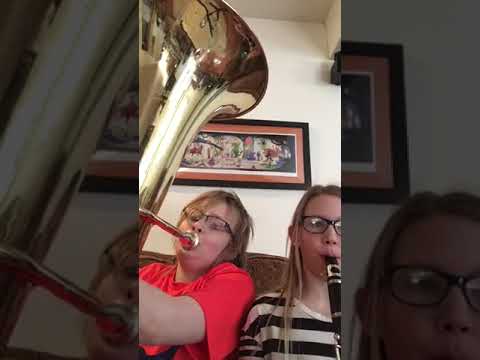
The width and height of the screenshot is (480, 360). Find the location of `above picture frame`. above picture frame is located at coordinates (246, 116), (268, 115), (299, 117), (343, 38), (367, 38), (396, 38).